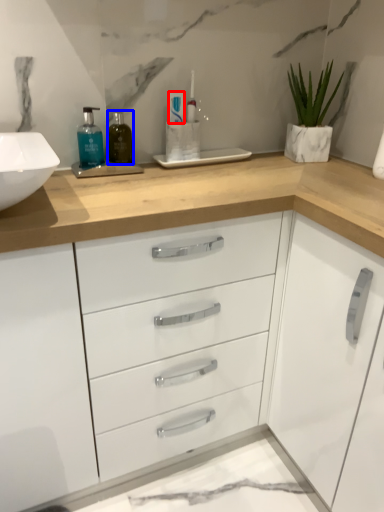
Question: Which of the following is the farthest to the observer, toothpaste (highlighted by a red box) or mouthwash (highlighted by a blue box)?

Choices:
 (A) toothpaste
 (B) mouthwash

Answer: (A)